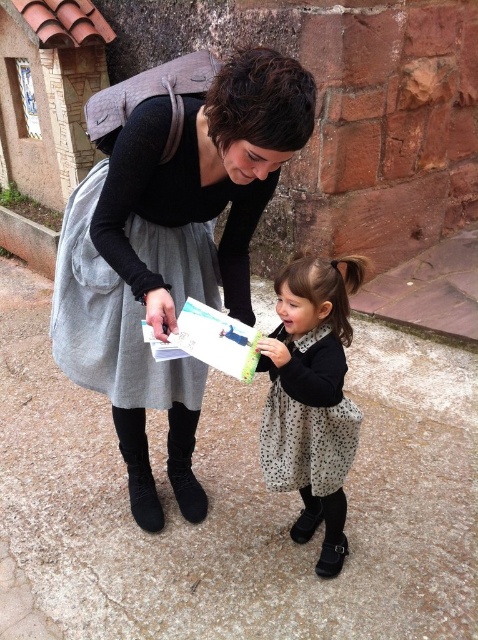
You are standing at the center of the image and want to place a small potted plant exactly where the matte black dress at center is located. What are the coordinates where you should place the potted plant?

The coordinates for the matte black dress at center are 0.350 in the x direction and 0.360 in the y direction. So you should place the potted plant at point (172, 224).

You are a fashion designer observing two dresses displayed on mannequins in a store window. The store window has a matte black dress at center and a polka dot fabric dress at lower center. Which dress is taller?

The matte black dress at center is taller than the polka dot fabric dress at lower center.